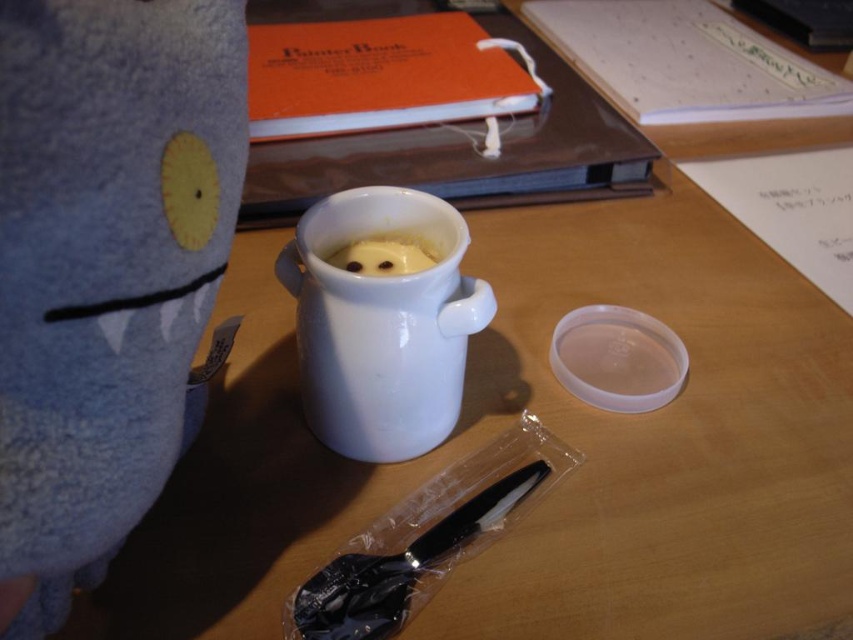
Between point (404, 417) and point (368, 273), which one is positioned behind?

The point (368, 273) is more distant.

Is point (317, 410) more distant than point (351, 253)?

No.

You are a GUI agent. You are given a task and a screenshot of the screen. Output one action in this format:
    pyautogui.click(x=<x>, y=<y>)
    Task: Click on the white glossy mug at center
    This screenshot has height=640, width=853.
    Given the screenshot: What is the action you would take?
    (381, 323)